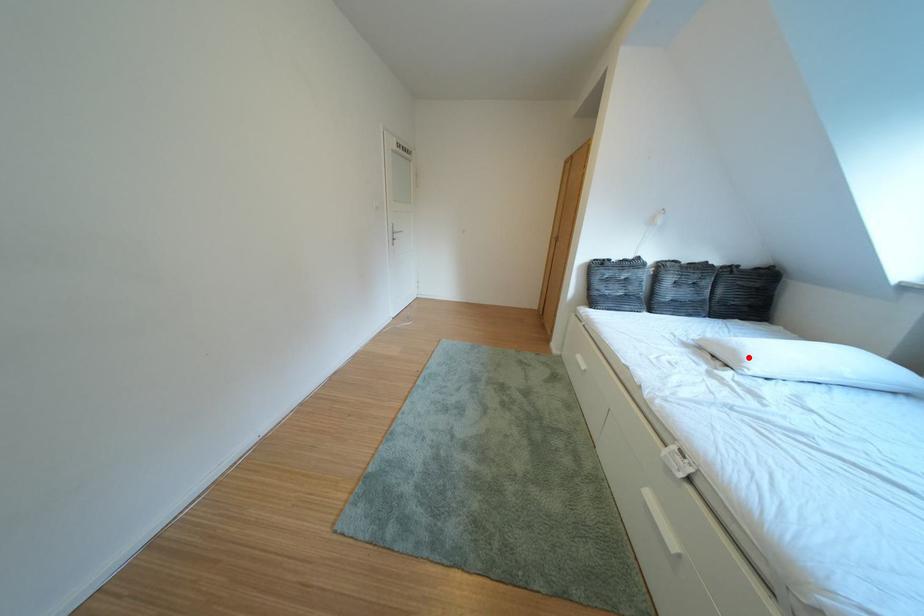
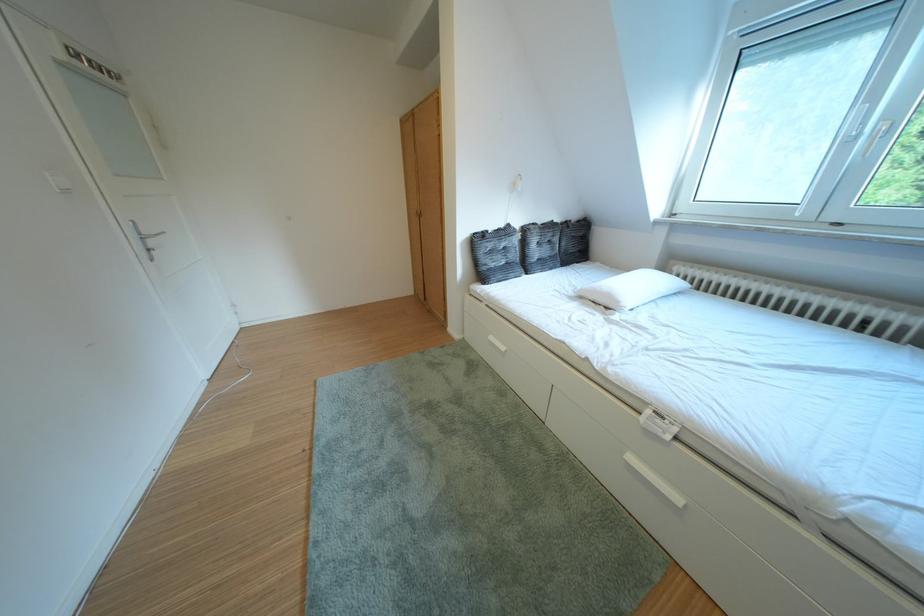
Question: I am providing you with two images of the same scene from different viewpoints. Given a red point in image1, look at the same physical point in image2. Is it:

Choices:
 (A) Closer to the viewpoint
 (B) Farther from the viewpoint

Answer: (A)